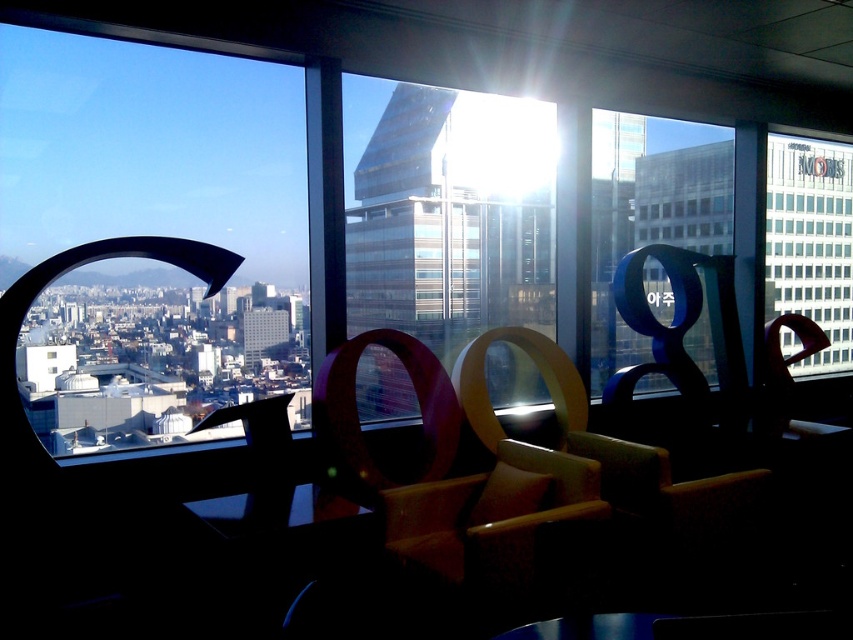
Question: Does transparent glass building at center appear over transparent glass window at upper right?

Choices:
 (A) yes
 (B) no

Answer: (B)

Question: Estimate the real-world distances between objects in this image. Which object is farther from the transparent glass window at upper left?

Choices:
 (A) transparent glass building at center
 (B) transparent glass window at upper right

Answer: (B)

Question: Which point is farther to the camera?

Choices:
 (A) [x=827, y=216]
 (B) [x=437, y=138]

Answer: (A)

Question: Which of these objects is positioned closest to the transparent glass window at upper left?

Choices:
 (A) transparent glass window at upper right
 (B) transparent glass building at center

Answer: (B)

Question: Does transparent glass building at center have a larger size compared to transparent glass window at upper right?

Choices:
 (A) yes
 (B) no

Answer: (B)

Question: Can you confirm if transparent glass building at center is positioned to the left of transparent glass window at upper right?

Choices:
 (A) no
 (B) yes

Answer: (B)